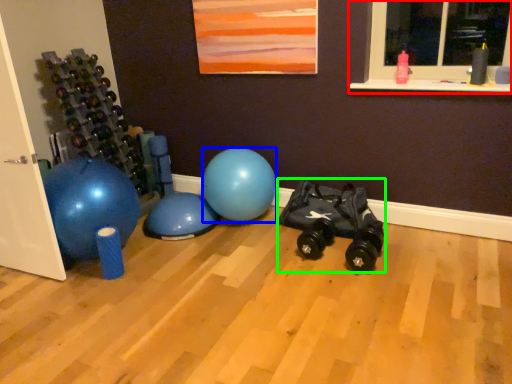
Question: Which object is positioned closest to window (highlighted by a red box)? Select from ball (highlighted by a blue box) and toy car (highlighted by a green box).

Choices:
 (A) ball
 (B) toy car

Answer: (B)